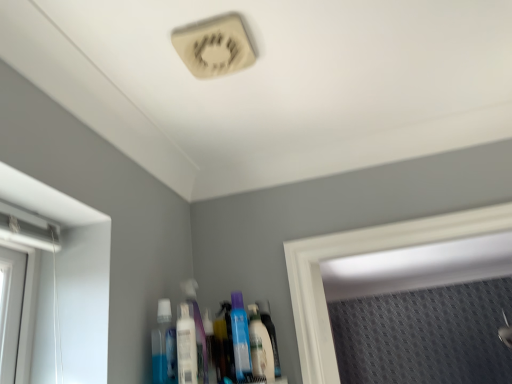
What is the approximate width of translucent plastic bottle at center?

translucent plastic bottle at center is 3.54 centimeters in width.

I want to click on blue translucent bottle at lower center, which ranks as the 3th mouthwash in right-to-left order, so click(x=164, y=346).

In order to face white glossy mouthwash at lower center, the 1th mouthwash when ordered from right to left, should I rotate leftwards or rightwards?

Turn right approximately 0.918 degrees to face it.

Describe the element at coordinates (225, 341) in the screenshot. I see `translucent plastic bottle at center` at that location.

Find the location of a particular element. translucent plastic bottle at center is located at coordinates (270, 333).

Is white plastic mouthwash at center, the 2th mouthwash viewed from the right, wider or thinner than translucent plastic bottle at center?

Clearly, white plastic mouthwash at center, the 2th mouthwash viewed from the right, has more width compared to translucent plastic bottle at center.

How different are the orientations of white plastic mouthwash at center, the 2th mouthwash viewed from the right, and translucent plastic bottle at center in degrees?

There is a 0.0028-degree angle between the facing directions of white plastic mouthwash at center, the 2th mouthwash viewed from the right, and translucent plastic bottle at center.

Is white plastic mouthwash at center, placed as the 2th mouthwash when sorted from left to right, positioned with its back to translucent plastic bottle at center?

white plastic mouthwash at center, placed as the 2th mouthwash when sorted from left to right, is not turned away from translucent plastic bottle at center.

Which object is closer to the camera taking this photo, white plastic mouthwash at center, placed as the 2th mouthwash when sorted from left to right, or translucent plastic bottle at center?

Positioned in front is white plastic mouthwash at center, placed as the 2th mouthwash when sorted from left to right.

Does translucent plastic bottle at center have a greater height compared to translucent plastic bottle at center?

Indeed, translucent plastic bottle at center has a greater height compared to translucent plastic bottle at center.

Is translucent plastic bottle at center completely or partially inside translucent plastic bottle at center?

No.

From a real-world perspective, is translucent plastic bottle at center physically above translucent plastic bottle at center?

Yes, from a real-world perspective, translucent plastic bottle at center is on top of translucent plastic bottle at center.

Is translucent plastic bottle at center turned away from translucent plastic bottle at center?

No.

Is the position of translucent plastic bottle at center more distant than that of translucent plastic bottle at center?

Yes, translucent plastic bottle at center is further from the camera.

From the image's perspective, is translucent plastic bottle at center beneath translucent plastic bottle at center?

Yes, from the image's perspective, translucent plastic bottle at center is beneath translucent plastic bottle at center.

How many degrees apart are the facing directions of translucent plastic bottle at center and translucent plastic bottle at center?

They differ by 0.000989 degrees in their facing directions.

Is translucent plastic bottle at center not near translucent plastic bottle at center?

No, there isn't a large distance between translucent plastic bottle at center and translucent plastic bottle at center.

Where is `mouthwash that is the 1st one when counting rightward from the blue translucent bottle at lower center, which ranks as the 3th mouthwash in right-to-left order`? The width and height of the screenshot is (512, 384). mouthwash that is the 1st one when counting rightward from the blue translucent bottle at lower center, which ranks as the 3th mouthwash in right-to-left order is located at coordinates click(x=186, y=345).

From the picture: Between blue translucent bottle at lower center, which is the 1th mouthwash in left-to-right order, and white plastic mouthwash at center, the 2th mouthwash viewed from the right, which one appears on the right side from the viewer's perspective?

white plastic mouthwash at center, the 2th mouthwash viewed from the right, is more to the right.

Which object is wider, white glossy mouthwash at lower center, the 3th mouthwash positioned from the left, or translucent plastic bottle at center?

white glossy mouthwash at lower center, the 3th mouthwash positioned from the left.

Considering the sizes of objects white glossy mouthwash at lower center, the 1th mouthwash when ordered from right to left, and translucent plastic bottle at center in the image provided, who is bigger, white glossy mouthwash at lower center, the 1th mouthwash when ordered from right to left, or translucent plastic bottle at center?

Bigger between the two is white glossy mouthwash at lower center, the 1th mouthwash when ordered from right to left.

Which object is positioned more to the right, white glossy mouthwash at lower center, the 1th mouthwash when ordered from right to left, or translucent plastic bottle at center?

Positioned to the right is white glossy mouthwash at lower center, the 1th mouthwash when ordered from right to left.

From the image's perspective, is white glossy mouthwash at lower center, the 1th mouthwash when ordered from right to left, beneath translucent plastic bottle at center?

No, from the image's perspective, white glossy mouthwash at lower center, the 1th mouthwash when ordered from right to left, is not below translucent plastic bottle at center.

From the image's perspective, is translucent plastic bottle at center under white glossy mouthwash at lower center, the 1th mouthwash when ordered from right to left?

Indeed, from the image's perspective, translucent plastic bottle at center is shown beneath white glossy mouthwash at lower center, the 1th mouthwash when ordered from right to left.

Consider the image. From a real-world perspective, between translucent plastic bottle at center and white glossy mouthwash at lower center, the 3th mouthwash positioned from the left, who is vertically lower?

translucent plastic bottle at center is physically lower.

Is white glossy mouthwash at lower center, the 3th mouthwash positioned from the left, at the back of translucent plastic bottle at center?

translucent plastic bottle at center is not turned away from white glossy mouthwash at lower center, the 3th mouthwash positioned from the left.

Which mouthwash is the 1st one when counting from the front of the translucent plastic bottle at center? Please provide its 2D coordinates.

[(260, 346)]

Considering the sizes of objects translucent plastic bottle at center and blue translucent bottle at lower center, which is the 1th mouthwash in left-to-right order, in the image provided, who is bigger, translucent plastic bottle at center or blue translucent bottle at lower center, which is the 1th mouthwash in left-to-right order,?

Bigger between the two is blue translucent bottle at lower center, which is the 1th mouthwash in left-to-right order.

From the image's perspective, which one is positioned higher, translucent plastic bottle at center or blue translucent bottle at lower center, which ranks as the 3th mouthwash in right-to-left order?

From the image's view, blue translucent bottle at lower center, which ranks as the 3th mouthwash in right-to-left order, is above.

Who is shorter, translucent plastic bottle at center or blue translucent bottle at lower center, which is the 1th mouthwash in left-to-right order?

translucent plastic bottle at center.

Where is `the 2nd mouthwash above the translucent plastic bottle at center (from the image's perspective)`? the 2nd mouthwash above the translucent plastic bottle at center (from the image's perspective) is located at coordinates (164, 346).

The height and width of the screenshot is (384, 512). In order to click on bottle that is under the white plastic mouthwash at center, the 2th mouthwash viewed from the right (from a real-world perspective) in this screenshot , I will do `click(270, 333)`.

Where is `bottle located above the translucent plastic bottle at center (from a real-world perspective)`? This screenshot has height=384, width=512. bottle located above the translucent plastic bottle at center (from a real-world perspective) is located at coordinates (270, 333).

From the image, which object appears to be nearer to white glossy mouthwash at lower center, the 1th mouthwash when ordered from right to left, translucent plastic bottle at center or white plastic mouthwash at center, placed as the 2th mouthwash when sorted from left to right?

translucent plastic bottle at center.

Looking at this image, from the image, which object appears to be farther from translucent plastic bottle at center, blue translucent bottle at lower center, which ranks as the 3th mouthwash in right-to-left order, or translucent plastic bottle at center?

blue translucent bottle at lower center, which ranks as the 3th mouthwash in right-to-left order, is further to translucent plastic bottle at center.

Considering their positions, is blue translucent bottle at lower center, which is the 1th mouthwash in left-to-right order, positioned further to white glossy mouthwash at lower center, the 3th mouthwash positioned from the left, than translucent plastic bottle at center?

blue translucent bottle at lower center, which is the 1th mouthwash in left-to-right order, is positioned further to the anchor white glossy mouthwash at lower center, the 3th mouthwash positioned from the left.

From the image, which object appears to be nearer to translucent plastic bottle at center, translucent plastic bottle at center or white glossy mouthwash at lower center, the 3th mouthwash positioned from the left?

Among the two, white glossy mouthwash at lower center, the 3th mouthwash positioned from the left, is located nearer to translucent plastic bottle at center.

Based on their spatial positions, is white glossy mouthwash at lower center, the 1th mouthwash when ordered from right to left, or white plastic mouthwash at center, placed as the 2th mouthwash when sorted from left to right, further from translucent plastic bottle at center?

The object further to translucent plastic bottle at center is white plastic mouthwash at center, placed as the 2th mouthwash when sorted from left to right.

When comparing their distances from translucent plastic bottle at center, does translucent plastic bottle at center or white plastic mouthwash at center, placed as the 2th mouthwash when sorted from left to right, seem further?

white plastic mouthwash at center, placed as the 2th mouthwash when sorted from left to right, is positioned further to the anchor translucent plastic bottle at center.

Considering their positions, is blue translucent bottle at lower center, which is the 1th mouthwash in left-to-right order, positioned further to white glossy mouthwash at lower center, the 3th mouthwash positioned from the left, than translucent plastic bottle at center?

Among the two, blue translucent bottle at lower center, which is the 1th mouthwash in left-to-right order, is located further to white glossy mouthwash at lower center, the 3th mouthwash positioned from the left.

Considering their positions, is blue translucent bottle at lower center, which ranks as the 3th mouthwash in right-to-left order, positioned closer to translucent plastic bottle at center than translucent plastic bottle at center?

translucent plastic bottle at center lies closer to translucent plastic bottle at center than the other object.

You are a GUI agent. You are given a task and a screenshot of the screen. Output one action in this format:
    pyautogui.click(x=<x>, y=<y>)
    Task: Click on the mouthwash located between translucent plastic bottle at center and translucent plastic bottle at center in the left-right direction
    The image size is (512, 384).
    Given the screenshot: What is the action you would take?
    pyautogui.click(x=260, y=346)

Image resolution: width=512 pixels, height=384 pixels. What are the coordinates of `toiletry between white plastic mouthwash at center, placed as the 2th mouthwash when sorted from left to right, and translucent plastic bottle at center` in the screenshot? It's located at [225, 341].

You are a GUI agent. You are given a task and a screenshot of the screen. Output one action in this format:
    pyautogui.click(x=<x>, y=<y>)
    Task: Click on the mouthwash between white plastic mouthwash at center, the 2th mouthwash viewed from the right, and translucent plastic bottle at center
    This screenshot has width=512, height=384.
    Given the screenshot: What is the action you would take?
    pyautogui.click(x=260, y=346)

I want to click on toiletry between white plastic mouthwash at center, the 2th mouthwash viewed from the right, and white glossy mouthwash at lower center, the 1th mouthwash when ordered from right to left, from left to right, so click(225, 341).